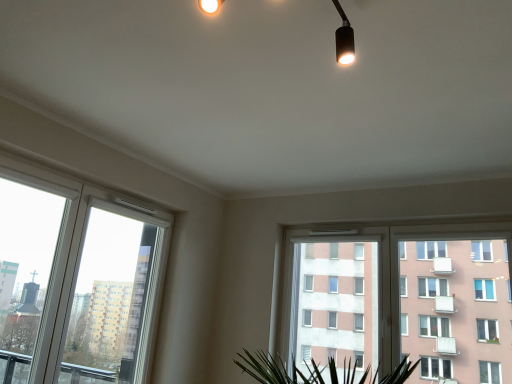
I want to click on white plastic window at center, arranged as the first window when viewed from the right, so click(405, 300).

The width and height of the screenshot is (512, 384). Describe the element at coordinates (405, 300) in the screenshot. I see `white plastic window at center, the 2th window positioned from the left` at that location.

Where is `white plastic window at left, which ranks as the 2th window in right-to-left order`? The image size is (512, 384). white plastic window at left, which ranks as the 2th window in right-to-left order is located at coordinates (76, 280).

What do you see at coordinates (76, 280) in the screenshot?
I see `white plastic window at left, which ranks as the 2th window in right-to-left order` at bounding box center [76, 280].

Find the location of a particular element. Image resolution: width=512 pixels, height=384 pixels. white plastic window at center, arranged as the first window when viewed from the right is located at coordinates (405, 300).

Considering the positions of objects white plastic window at center, arranged as the first window when viewed from the right, and white plastic window at left, the 1th window in the left-to-right sequence, in the image provided, who is more to the right, white plastic window at center, arranged as the first window when viewed from the right, or white plastic window at left, the 1th window in the left-to-right sequence,?

white plastic window at center, arranged as the first window when viewed from the right.

Does white plastic window at center, the 2th window positioned from the left, come in front of white plastic window at left, which ranks as the 2th window in right-to-left order?

No, it is behind white plastic window at left, which ranks as the 2th window in right-to-left order.

Is point (389, 301) in front of point (159, 256)?

Yes.

From the image's perspective, who appears lower, white plastic window at center, the 2th window positioned from the left, or white plastic window at left, which ranks as the 2th window in right-to-left order?

white plastic window at center, the 2th window positioned from the left, appears lower in the image.

From a real-world perspective, is white plastic window at center, arranged as the first window when viewed from the right, physically below white plastic window at left, the 1th window in the left-to-right sequence?

No.

Which of these two, white plastic window at center, arranged as the first window when viewed from the right, or white plastic window at left, the 1th window in the left-to-right sequence, is thinner?

Thinner between the two is white plastic window at left, the 1th window in the left-to-right sequence.

In terms of height, does white plastic window at center, the 2th window positioned from the left, look taller or shorter compared to white plastic window at left, which ranks as the 2th window in right-to-left order?

Considering their sizes, white plastic window at center, the 2th window positioned from the left, has less height than white plastic window at left, which ranks as the 2th window in right-to-left order.

Does white plastic window at center, the 2th window positioned from the left, have a larger size compared to white plastic window at left, the 1th window in the left-to-right sequence?

Correct, white plastic window at center, the 2th window positioned from the left, is larger in size than white plastic window at left, the 1th window in the left-to-right sequence.

Does white plastic window at center, arranged as the first window when viewed from the right, contain white plastic window at left, the 1th window in the left-to-right sequence?

Definitely not — white plastic window at left, the 1th window in the left-to-right sequence, is not inside white plastic window at center, arranged as the first window when viewed from the right.

Are white plastic window at center, the 2th window positioned from the left, and white plastic window at left, which ranks as the 2th window in right-to-left order, making contact?

No, white plastic window at center, the 2th window positioned from the left, is not beside white plastic window at left, which ranks as the 2th window in right-to-left order.

Is white plastic window at center, the 2th window positioned from the left, positioned with its back to white plastic window at left, which ranks as the 2th window in right-to-left order?

white plastic window at center, the 2th window positioned from the left, does not have its back to white plastic window at left, which ranks as the 2th window in right-to-left order.

How different are the orientations of white plastic window at center, arranged as the first window when viewed from the right, and white plastic window at left, the 1th window in the left-to-right sequence, in degrees?

87.7 degrees.

In the scene shown: How distant is white plastic window at center, arranged as the first window when viewed from the right, from white plastic window at left, the 1th window in the left-to-right sequence?

white plastic window at center, arranged as the first window when viewed from the right, and white plastic window at left, the 1th window in the left-to-right sequence, are 1.75 meters apart.

The image size is (512, 384). What are the coordinates of `window lying in front of the white plastic window at center, arranged as the first window when viewed from the right` in the screenshot? It's located at (76, 280).

Looking at this image, considering the relative positions of white plastic window at left, the 1th window in the left-to-right sequence, and white plastic window at center, the 2th window positioned from the left, in the image provided, is white plastic window at left, the 1th window in the left-to-right sequence, to the right of white plastic window at center, the 2th window positioned from the left, from the viewer's perspective?

No, white plastic window at left, the 1th window in the left-to-right sequence, is not to the right of white plastic window at center, the 2th window positioned from the left.

Who is more distant, white plastic window at left, the 1th window in the left-to-right sequence, or white plastic window at center, the 2th window positioned from the left?

white plastic window at center, the 2th window positioned from the left, is more distant.

Does point (90, 234) come in front of point (335, 244)?

No, (90, 234) is further to viewer.

From the image's perspective, is white plastic window at left, the 1th window in the left-to-right sequence, located above or below white plastic window at center, the 2th window positioned from the left?

white plastic window at left, the 1th window in the left-to-right sequence, is situated higher than white plastic window at center, the 2th window positioned from the left, in the image.

From the picture: From a real-world perspective, who is located lower, white plastic window at left, the 1th window in the left-to-right sequence, or white plastic window at center, the 2th window positioned from the left?

white plastic window at left, the 1th window in the left-to-right sequence, is physically lower.

Is white plastic window at left, which ranks as the 2th window in right-to-left order, thinner than white plastic window at center, the 2th window positioned from the left?

Indeed, white plastic window at left, which ranks as the 2th window in right-to-left order, has a lesser width compared to white plastic window at center, the 2th window positioned from the left.

Considering the sizes of white plastic window at left, the 1th window in the left-to-right sequence, and white plastic window at center, the 2th window positioned from the left, in the image, is white plastic window at left, the 1th window in the left-to-right sequence, taller or shorter than white plastic window at center, the 2th window positioned from the left,?

Considering their sizes, white plastic window at left, the 1th window in the left-to-right sequence, has more height than white plastic window at center, the 2th window positioned from the left.

Which of these two, white plastic window at left, the 1th window in the left-to-right sequence, or white plastic window at center, the 2th window positioned from the left, is smaller?

white plastic window at left, the 1th window in the left-to-right sequence.

In the scene shown: Choose the correct answer: Is white plastic window at left, which ranks as the 2th window in right-to-left order, inside white plastic window at center, arranged as the first window when viewed from the right, or outside it?

white plastic window at left, which ranks as the 2th window in right-to-left order, lies outside white plastic window at center, arranged as the first window when viewed from the right.

Consider the image. Is white plastic window at left, which ranks as the 2th window in right-to-left order, facing towards white plastic window at center, arranged as the first window when viewed from the right?

No, white plastic window at left, which ranks as the 2th window in right-to-left order, is not aimed at white plastic window at center, arranged as the first window when viewed from the right.

Can you tell me how much white plastic window at left, the 1th window in the left-to-right sequence, and white plastic window at center, the 2th window positioned from the left, differ in facing direction?

87.7 degrees.

You are a GUI agent. You are given a task and a screenshot of the screen. Output one action in this format:
    pyautogui.click(x=<x>, y=<y>)
    Task: Click on the window above the white plastic window at left, which ranks as the 2th window in right-to-left order (from a real-world perspective)
    This screenshot has width=512, height=384.
    Given the screenshot: What is the action you would take?
    pyautogui.click(x=405, y=300)

At what (x,y) coordinates should I click in order to perform the action: click on window below the white plastic window at center, the 2th window positioned from the left (from a real-world perspective). Please return your answer as a coordinate pair (x, y). The image size is (512, 384). Looking at the image, I should click on (76, 280).

Where is `window in front of the white plastic window at center, arranged as the first window when viewed from the right`? window in front of the white plastic window at center, arranged as the first window when viewed from the right is located at coordinates (76, 280).